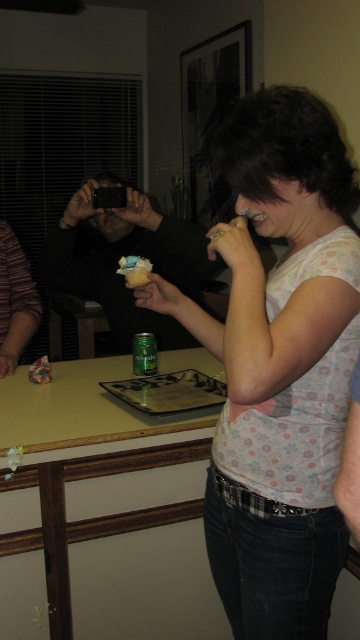
You are setting up a photo shoot in the scene. You need to place a 12cm tall decorative vase between the light brown laminate counter at center and the matte black phone at center. Can the vase fit vertically between them?

The light brown laminate counter at center is taller than the matte black phone at center. Since the vase is 12cm tall, it can fit vertically between them as long as the space between the two objects is at least 12cm. However, the exact vertical clearance isn

You are trying to decide which item to place in a small gift box that can only accommodate items up to 10 cm in width. You have the matte black phone at center and the matte paper muffin at center. Based on their sizes, which item would fit better in the box?

The matte paper muffin at center would fit better in the box since the matte black phone at center has a larger width than the matte paper muffin at center, making the latter more suitable for the small gift box.

Looking at this image, you are at a party and want to place a small gift on the closest surface to you. Which object should you choose between the light brown laminate counter at center and the matte black phone at center?

The light brown laminate counter at center is closer to the viewer than the matte black phone at center, so you should place the small gift on the light brown laminate counter at center.